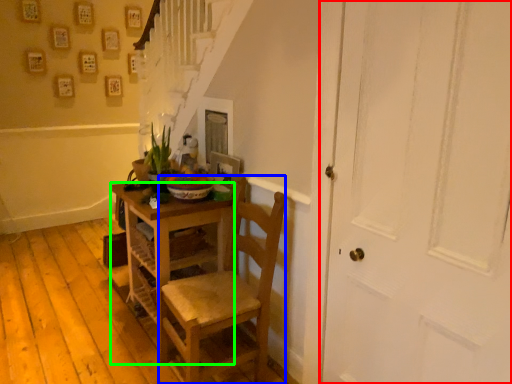
Question: Which object is the closest to the door (highlighted by a red box)? Choose among these: chair (highlighted by a blue box) or desk (highlighted by a green box).

Choices:
 (A) chair
 (B) desk

Answer: (A)